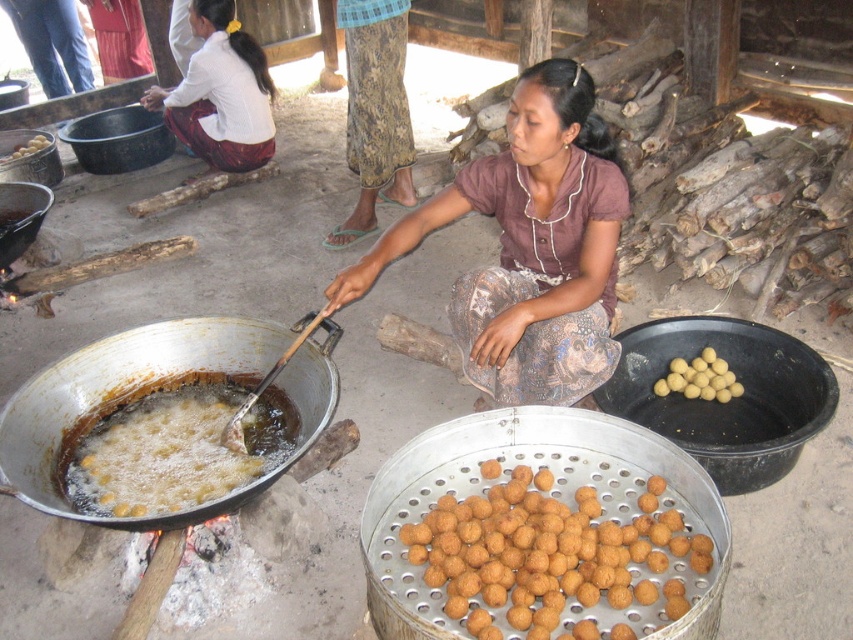
You are a customer in a food market and see the brown fabric skirt at center and the golden crispy balls at lower left. Which item is located to the right of the other?

The brown fabric skirt at center is positioned on the right side of golden crispy balls at lower left, so the brown fabric skirt at center is to the right of the golden crispy balls at lower left.

You are a chef in the scene and want to reach the golden crispy balls at lower left without touching the brown fabric skirt at center. Is this possible?

The brown fabric skirt at center is much taller than the golden crispy balls at lower left, so you can reach the golden crispy balls at lower left without touching the brown fabric skirt at center by bending down or moving sideways.